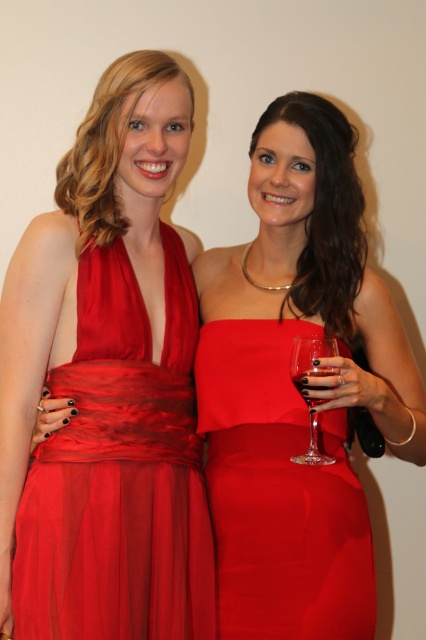
Question: Estimate the real-world distances between objects in this image. Which object is closer to the matte red dress at center?

Choices:
 (A) transparent glass at right
 (B) transparent glass at center
 (C) shiny satin dress at left

Answer: (C)

Question: Which point is farther from the camera taking this photo?

Choices:
 (A) (305, 388)
 (B) (313, 456)
 (C) (158, 413)
 (D) (333, 438)

Answer: (D)

Question: Is shiny satin dress at left thinner than matte red dress at center?

Choices:
 (A) yes
 (B) no

Answer: (B)

Question: Estimate the real-world distances between objects in this image. Which object is farther from the transparent glass at right?

Choices:
 (A) transparent glass at center
 (B) matte red dress at center
 (C) shiny satin dress at left

Answer: (C)

Question: Is transparent glass at center wider than transparent glass at right?

Choices:
 (A) no
 (B) yes

Answer: (B)

Question: Is matte red dress at center smaller than transparent glass at center?

Choices:
 (A) no
 (B) yes

Answer: (A)